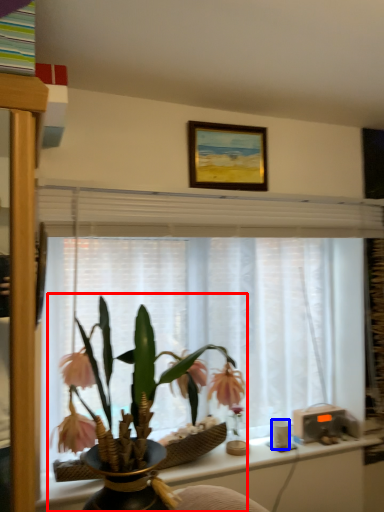
Question: Which object is closer to the camera taking this photo, houseplant (highlighted by a red box) or coffee cup (highlighted by a blue box)?

Choices:
 (A) houseplant
 (B) coffee cup

Answer: (A)